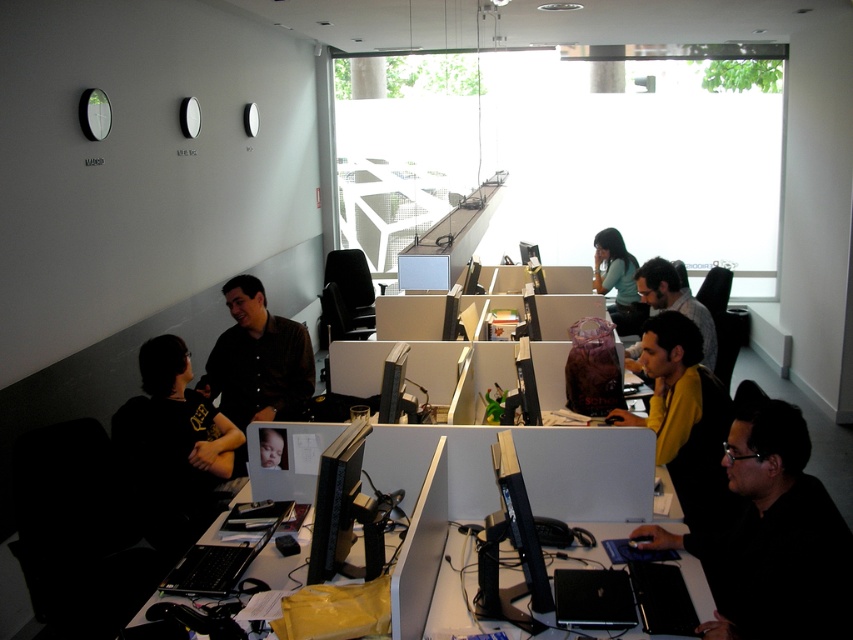
Based on the photo, is black matte shirt at left shorter than yellow matte shirt at center?

In fact, black matte shirt at left may be taller than yellow matte shirt at center.

Which is more to the right, black matte shirt at left or yellow matte shirt at center?

From the viewer's perspective, yellow matte shirt at center appears more on the right side.

Does point (235, 448) come farther from viewer compared to point (643, 422)?

Yes, it is behind point (643, 422).

Where is `black matte shirt at left`? black matte shirt at left is located at coordinates (x=172, y=445).

Can you confirm if matte brown shirt at center is positioned to the right of smooth skin baby at center?

Incorrect, matte brown shirt at center is not on the right side of smooth skin baby at center.

Is point (224, 289) closer to camera compared to point (283, 465)?

No, (224, 289) is further to viewer.

Locate an element on the screen. The image size is (853, 640). matte brown shirt at center is located at coordinates (257, 358).

Does point (173, 472) come farther from viewer compared to point (221, 388)?

No, it is not.

Does black matte shirt at left appear under matte brown shirt at center?

Yes.

The width and height of the screenshot is (853, 640). What do you see at coordinates (172, 445) in the screenshot?
I see `black matte shirt at left` at bounding box center [172, 445].

This screenshot has height=640, width=853. What are the coordinates of `black matte shirt at left` in the screenshot? It's located at (172, 445).